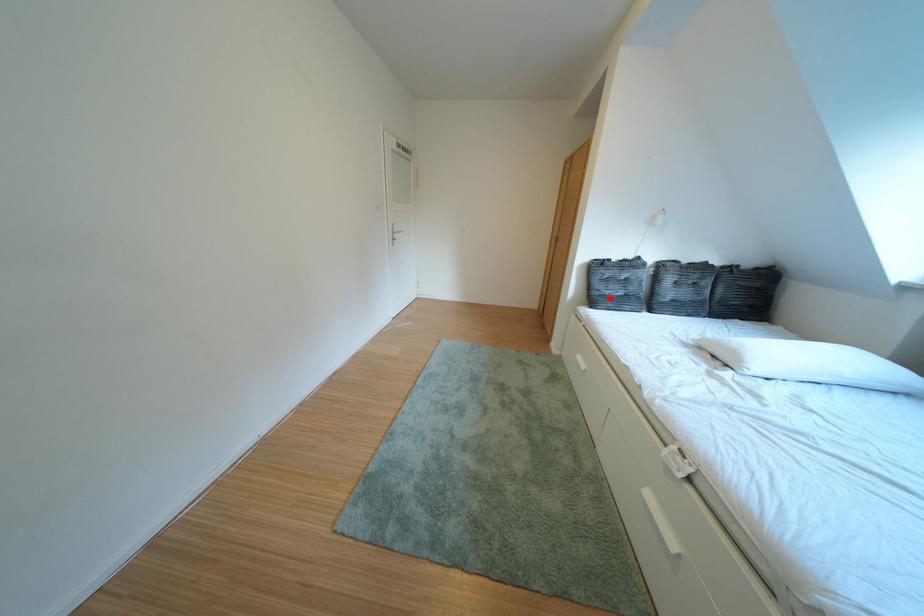
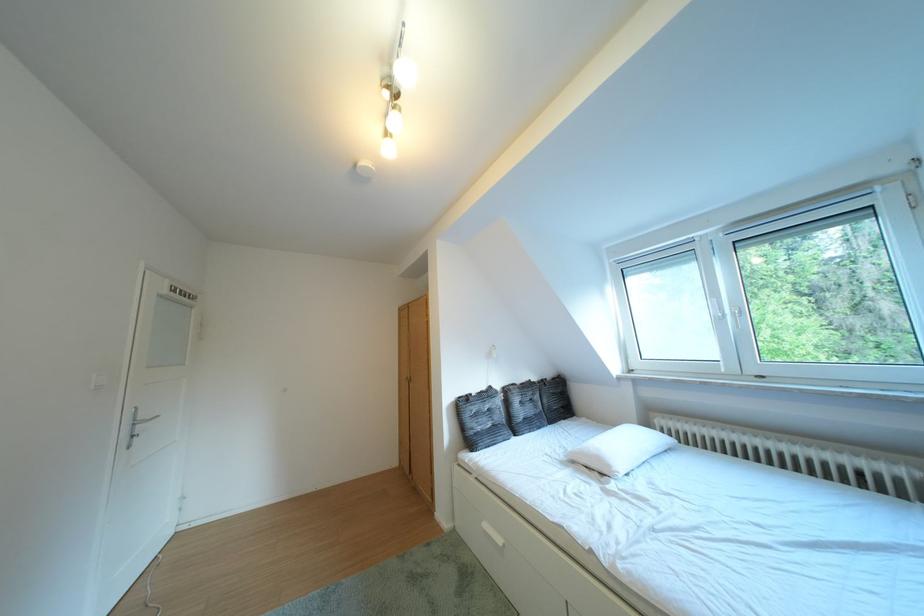
Question: I am providing you with two images of the same scene from different viewpoints. Image1 has a red point marked. In image2, the corresponding 3D location appears at what relative position? Reply with the corresponding letter.

Choices:
 (A) Closer
 (B) Farther

Answer: (B)